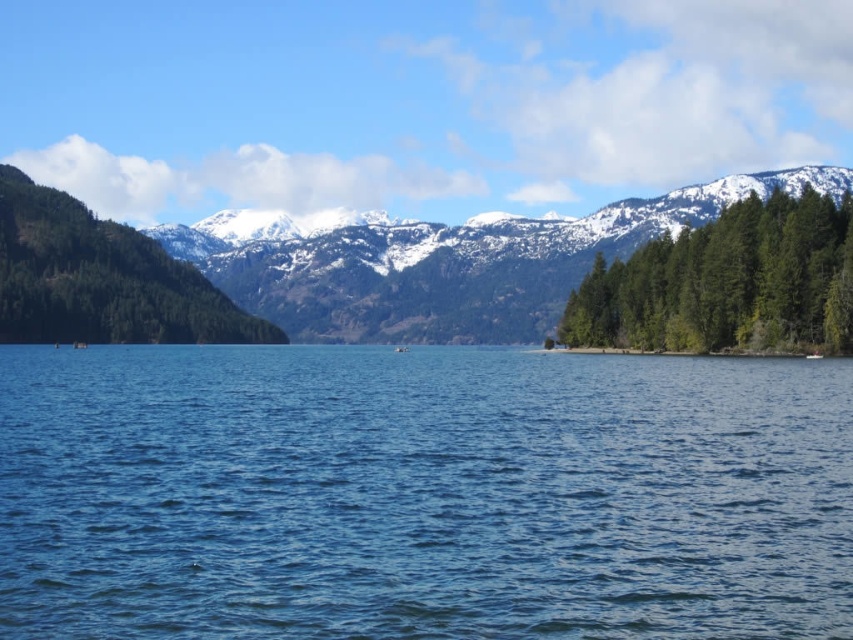
Does blue water at center have a larger size compared to green textured trees at right?

Yes.

Locate an element on the screen. blue water at center is located at coordinates click(421, 493).

This screenshot has width=853, height=640. What are the coordinates of `blue water at center` in the screenshot? It's located at (421, 493).

Looking at this image, can you confirm if snowy forested mountain at center is shorter than green textured trees at right?

In fact, snowy forested mountain at center may be taller than green textured trees at right.

Which is in front, point (778, 177) or point (769, 342)?

Point (769, 342) is more forward.

This screenshot has height=640, width=853. I want to click on snowy forested mountain at center, so click(444, 260).

Which is behind, point (641, 468) or point (73, 205)?

Positioned behind is point (73, 205).

Is blue water at center to the left of green textured forest at left from the viewer's perspective?

In fact, blue water at center is to the right of green textured forest at left.

Between point (692, 620) and point (28, 321), which one is positioned behind?

Positioned behind is point (28, 321).

This screenshot has width=853, height=640. Find the location of `blue water at center`. blue water at center is located at coordinates (421, 493).